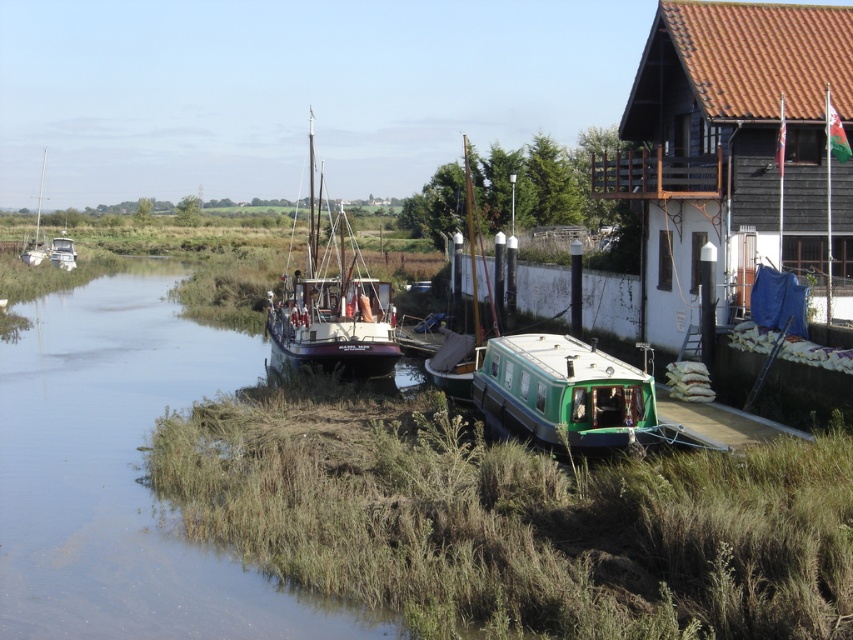
Describe the element at coordinates (125, 474) in the screenshot. Image resolution: width=853 pixels, height=640 pixels. I see `brushed metal water at center` at that location.

Locate an element on the screen. Image resolution: width=853 pixels, height=640 pixels. brushed metal water at center is located at coordinates (125, 474).

Locate an element on the screen. brushed metal water at center is located at coordinates (125, 474).

Can you confirm if brushed metal water at center is taller than wooden sailboat at center?

No.

Is brushed metal water at center shorter than wooden sailboat at center?

Correct, brushed metal water at center is not as tall as wooden sailboat at center.

Who is more forward, (224, 381) or (332, 342)?

Point (332, 342) is in front.

This screenshot has width=853, height=640. Find the location of `brushed metal water at center`. brushed metal water at center is located at coordinates (125, 474).

What do you see at coordinates (728, 147) in the screenshot? The image size is (853, 640). I see `brown wooden hut at upper right` at bounding box center [728, 147].

This screenshot has height=640, width=853. I want to click on brown wooden hut at upper right, so click(728, 147).

Which is in front, point (669, 193) or point (546, 433)?

Positioned in front is point (546, 433).

Locate an element on the screen. brown wooden hut at upper right is located at coordinates (728, 147).